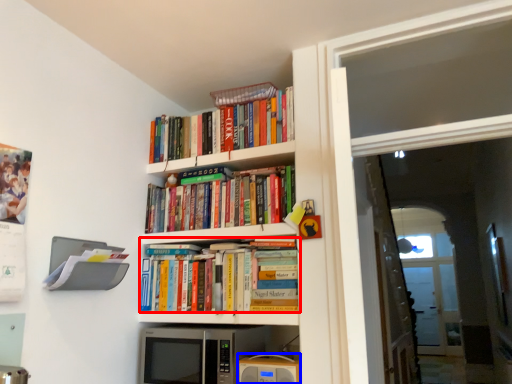
Question: Which point is further to the camera, book (highlighted by a red box) or appliance (highlighted by a blue box)?

Choices:
 (A) book
 (B) appliance

Answer: (A)